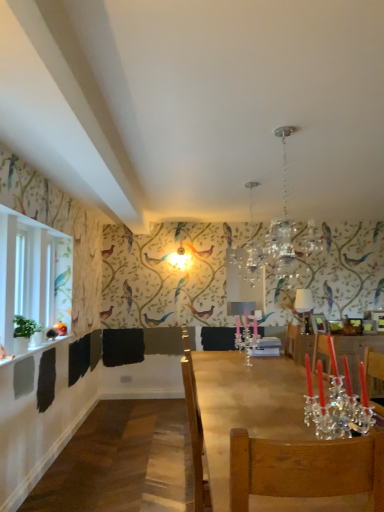
Question: Which is correct: white glossy lampshade at upper center is inside crystal glass chandelier at upper center, or outside of it?

Choices:
 (A) outside
 (B) inside

Answer: (A)

Question: Would you say white glossy lampshade at upper center is to the left or to the right of crystal glass chandelier at upper center in the picture?

Choices:
 (A) right
 (B) left

Answer: (A)

Question: Estimate the real-world distances between objects in this image. Which object is farther from the crystal glass chandelier at upper center?

Choices:
 (A) wooden table at center
 (B) white glossy lampshade at upper center
 (C) clear crystal candle holder at center

Answer: (A)

Question: Which object is the closest to the white glossy lampshade at upper center?

Choices:
 (A) crystal glass chandelier at upper center
 (B) wooden table at center
 (C) clear crystal candle holder at center

Answer: (A)